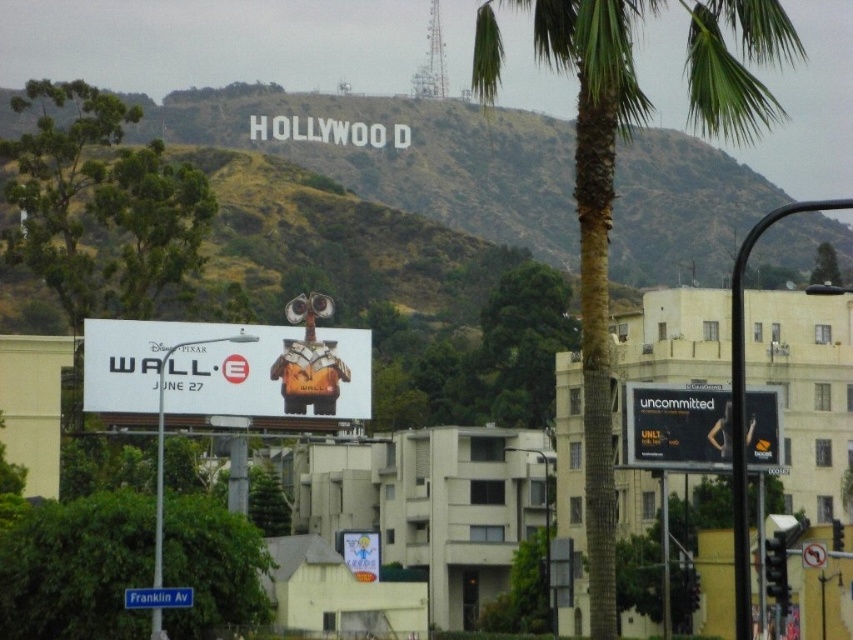
You are a photographer planning to capture a photo that includes both the green textured palm tree at center and the green leafy bush at lower left. Considering their sizes, which object should you position closer to the camera to ensure both fit in the frame?

The green textured palm tree at center is larger than the green leafy bush at lower left. To ensure both fit in the frame, position the larger palm tree closer to the camera so its size doesn

You are a drone operator who needs to deliver a package from the blue plastic street sign at lower left to the green grassy hill at upper center. Given that your drone has a maximum range of 200 meters, will it be able to make the delivery without recharging?

The green grassy hill at upper center is 237.40 meters away from the blue plastic street sign at lower left. Since the drone can only travel 200 meters before needing a recharge, it cannot make the delivery in one trip without recharging.

You are a photographer trying to capture both the green leafy tree at upper left and the metallic robot at center in a single shot. Based on their sizes in the image, which object would require you to adjust your camera angle more to include fully in the frame?

The green leafy tree at upper left might be wider than metallic robot at center, so it would require more adjustment to include fully in the frame.